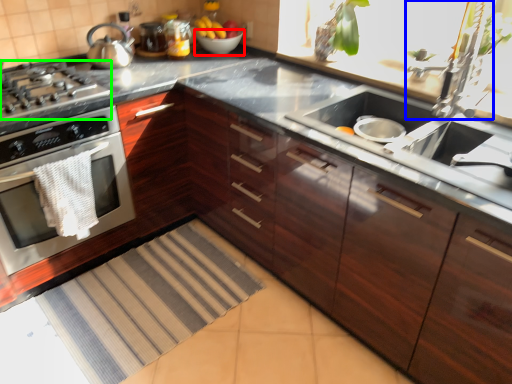
Question: Considering the real-world distances, which object is closest to bowl (highlighted by a red box)? faucet (highlighted by a blue box) or gas stove (highlighted by a green box).

Choices:
 (A) faucet
 (B) gas stove

Answer: (B)